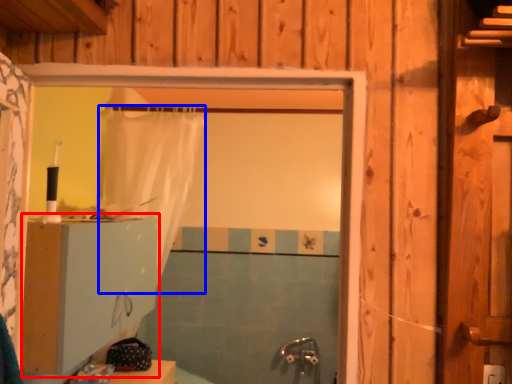
Question: Which of the following is the closest to the observer, dresser (highlighted by a red box) or shower curtain (highlighted by a blue box)?

Choices:
 (A) dresser
 (B) shower curtain

Answer: (A)